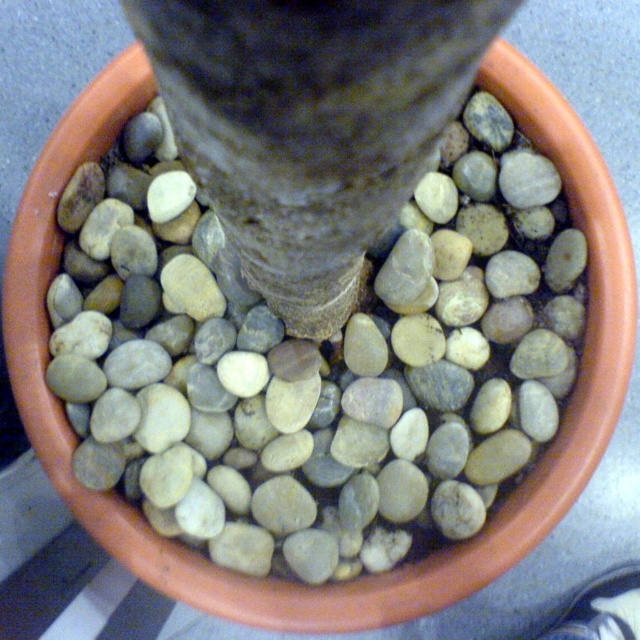
Question: Considering the relative positions of smooth gray pebble at center and smooth gray bark at center in the image provided, where is smooth gray pebble at center located with respect to smooth gray bark at center?

Choices:
 (A) right
 (B) left

Answer: (A)

Question: Among these objects, which one is nearest to the camera?

Choices:
 (A) smooth gray bark at center
 (B) smooth gray pebble at center

Answer: (A)

Question: Which of the following is the farthest from the observer?

Choices:
 (A) smooth gray pebble at center
 (B) smooth gray bark at center

Answer: (A)

Question: Is smooth gray pebble at center to the right of smooth gray bark at center from the viewer's perspective?

Choices:
 (A) yes
 (B) no

Answer: (A)

Question: Can you confirm if smooth gray pebble at center is positioned to the left of smooth gray bark at center?

Choices:
 (A) yes
 (B) no

Answer: (B)